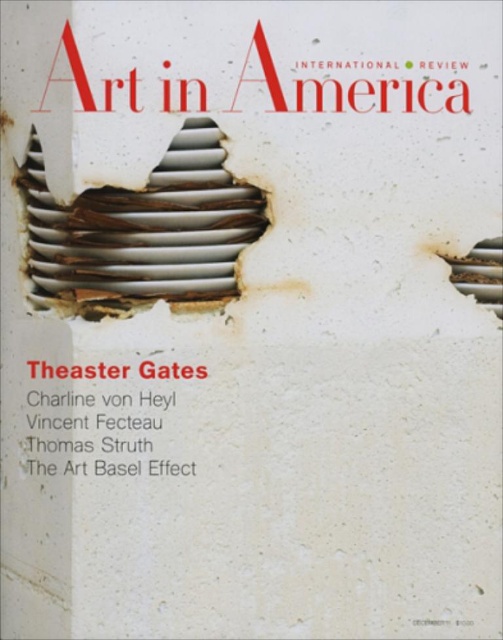
You are designing a layout for a magazine cover and need to ensure that the text and graphic elements are balanced. The white matte text at center and the rusty metal hole at center right are key elements. Which of these elements is bigger?

The white matte text at center is larger in size than the rusty metal hole at center right.

You are an art critic examining the magazine cover. You notice the rusty metal spiral at center and the rusty metal hole at center right. Which object appears closer to you on the cover?

The rusty metal spiral at center appears closer because it is in front of the rusty metal hole at center right.

You are designing a layout for the magazine cover and want to ensure the white matte text at center is easily readable. Given the rusty metal spiral at center, which object should you adjust in size to improve readability without removing either element?

Since the rusty metal spiral at center is wider than the white matte text at center, you should reduce the size of the rusty metal spiral at center to make the white matte text at center more prominent and readable.